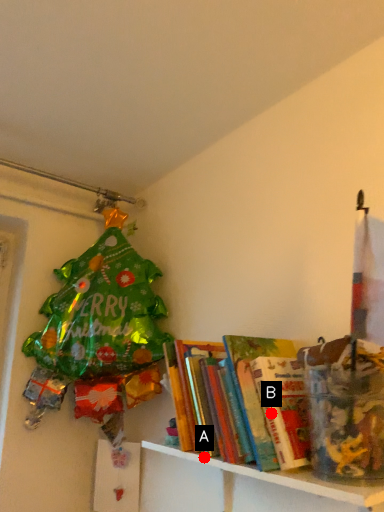
Question: Two points are circled on the image, labeled by A and B beside each circle. Which point appears closest to the camera in this image?

Choices:
 (A) A is closer
 (B) B is closer

Answer: (B)